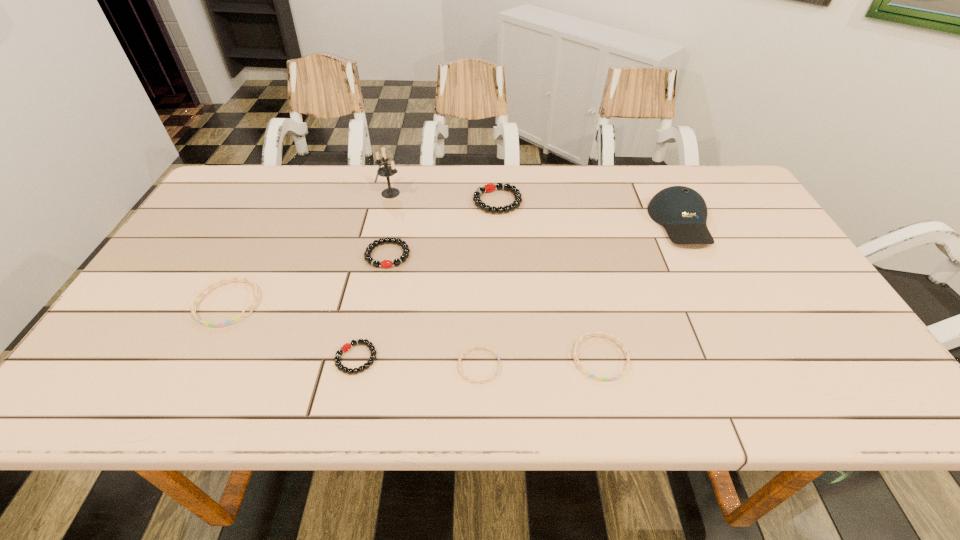
The height and width of the screenshot is (540, 960). In order to click on the tallest object in this screenshot , I will do `click(386, 171)`.

Identify the location of the seventh shortest object. This screenshot has width=960, height=540. (682, 211).

Identify the location of blue baseball cap. The width and height of the screenshot is (960, 540). (682, 211).

Find the location of `the farthest black bracelet`. the farthest black bracelet is located at coordinates (490, 187).

What are the coordinates of `the rightmost black bracelet` in the screenshot? It's located at (490, 187).

What are the coordinates of `the farthest blue bracelet` in the screenshot? It's located at tap(236, 318).

The width and height of the screenshot is (960, 540). What are the coordinates of `the third farthest bracelet` in the screenshot? It's located at (236, 318).

This screenshot has width=960, height=540. What are the coordinates of `the fifth nearest bracelet` in the screenshot? It's located at (367, 254).

The height and width of the screenshot is (540, 960). Find the location of `the second smallest black bracelet`. the second smallest black bracelet is located at coordinates (367, 254).

Locate an element on the screen. The height and width of the screenshot is (540, 960). the rightmost blue bracelet is located at coordinates (626, 352).